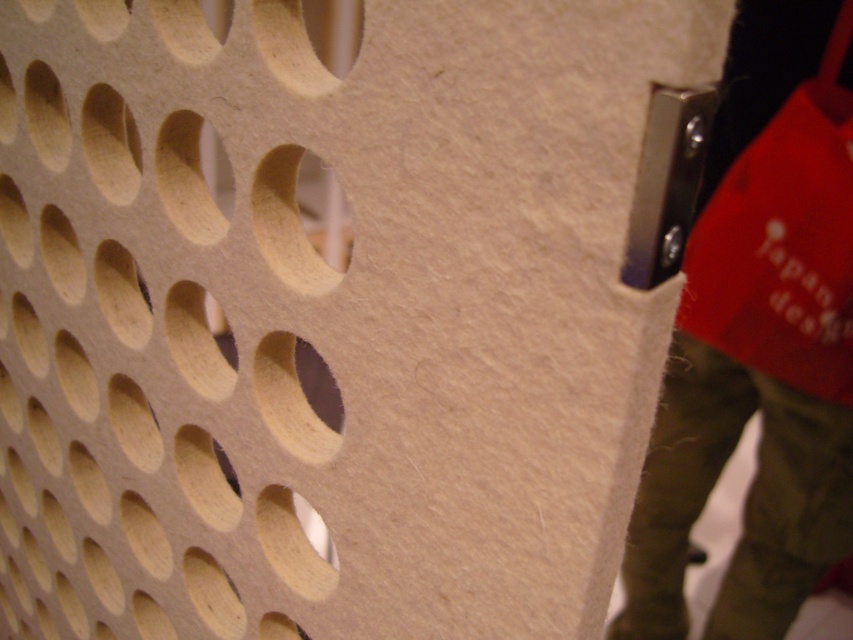
You are an interior designer examining the perforated wooden panel. You notice two holes at the center area. Which one is closer to you, the light brown cardboard hole at center or the matte wood hole at center?

The light brown cardboard hole at center is closer to you because it is positioned further to the viewer than the matte wood hole at center.

You are an interior designer assessing the placement of the matte red fabric at right and the light brown cardboard hole at center on the wooden panel. Which object occupies a larger vertical space on the panel?

The matte red fabric at right is much taller than the light brown cardboard hole at center, so it occupies a larger vertical space on the panel.

You are an interior designer arranging two decorative items on a shelf. You have a light brown cardboard hole at center and a matte wood hole at center. According to the scene, which one should you place on the left side of the shelf?

The light brown cardboard hole at center should be placed on the left side of the shelf because it is positioned to the left of the matte wood hole at center in the scene.